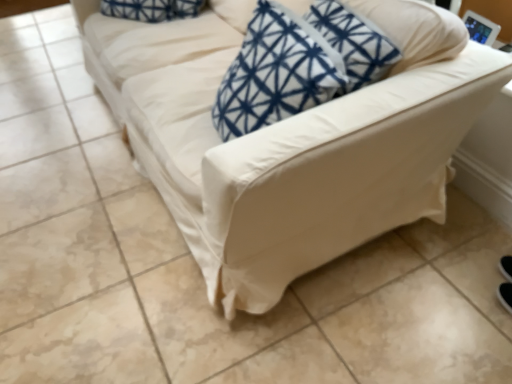
The image size is (512, 384). Find the location of `white fabric couch at center`. white fabric couch at center is located at coordinates (298, 155).

The height and width of the screenshot is (384, 512). What do you see at coordinates (298, 155) in the screenshot?
I see `white fabric couch at center` at bounding box center [298, 155].

The width and height of the screenshot is (512, 384). What are the coordinates of `white fabric couch at center` in the screenshot? It's located at (298, 155).